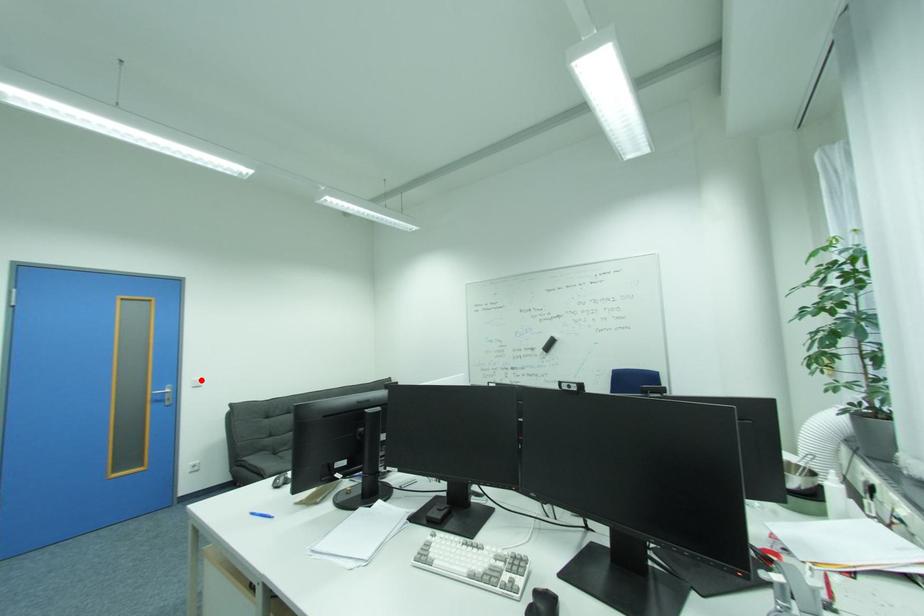
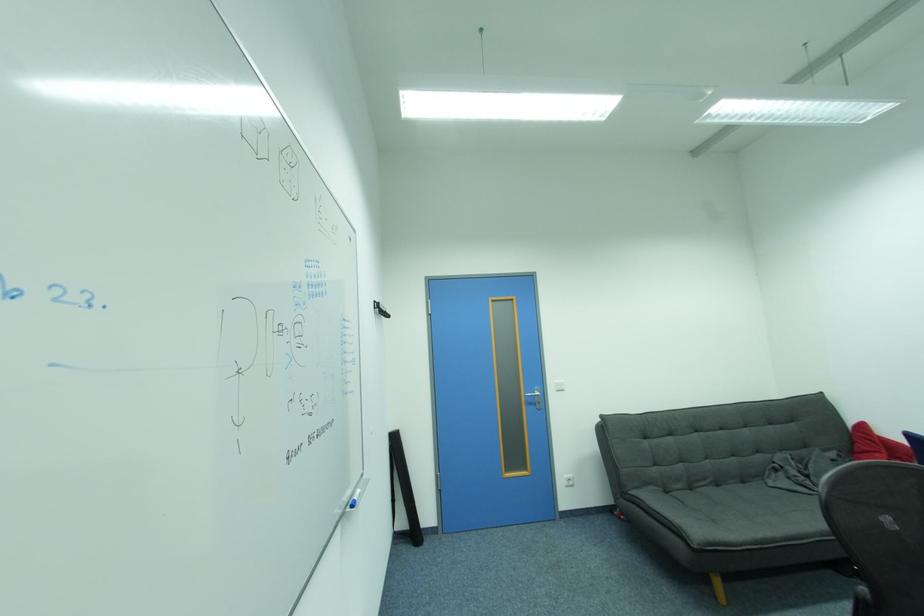
The point at the highlighted location is marked in the first image. Where is the corresponding point in the second image?

(564, 382)